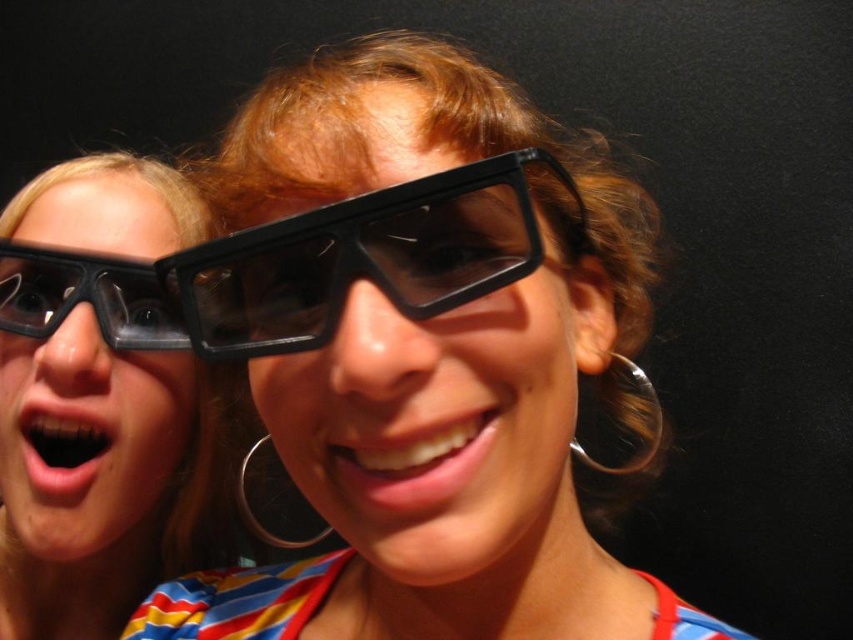
Can you confirm if black plastic glasses at center is bigger than transparent plastic goggles at left?

Indeed, black plastic glasses at center has a larger size compared to transparent plastic goggles at left.

Who is more forward, (515, 481) or (36, 248)?

Point (515, 481)

Does point (534, 296) come closer to viewer compared to point (117, 323)?

Yes, it is in front of point (117, 323).

Identify the location of black plastic glasses at center. (434, 419).

Does black plastic glasses at center have a larger size compared to matte black glasses at left?

No.

Is black plastic glasses at center positioned in front of matte black glasses at left?

Yes, it is in front of matte black glasses at left.

Is point (424, 120) farther from camera compared to point (109, 172)?

No, it is in front of (109, 172).

Locate an element on the screen. black plastic glasses at center is located at coordinates (434, 419).

Can you confirm if black plastic goggles at center is smaller than matte black glasses at left?

Indeed, black plastic goggles at center has a smaller size compared to matte black glasses at left.

Does point (524, 188) come behind point (177, 442)?

That is False.

This screenshot has width=853, height=640. I want to click on black plastic goggles at center, so click(x=368, y=257).